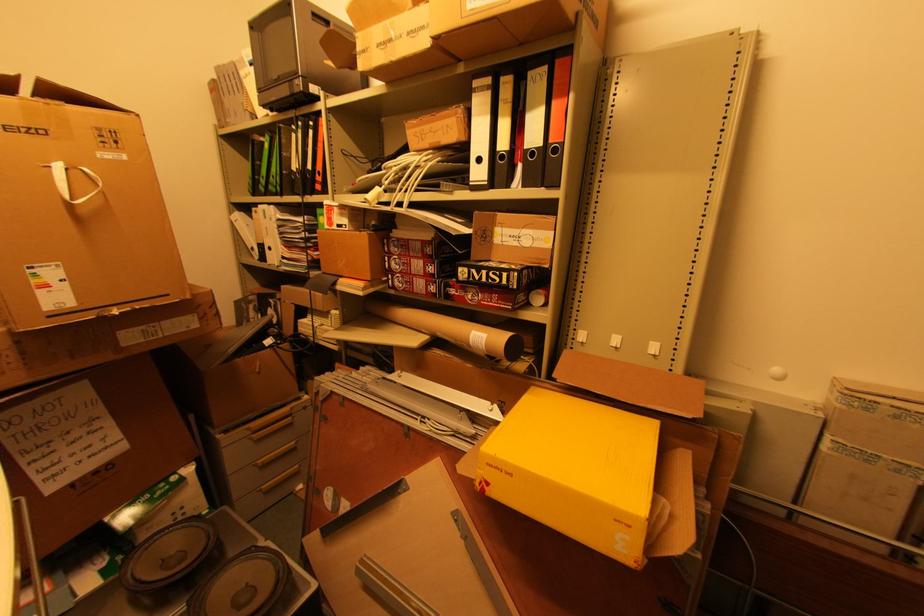
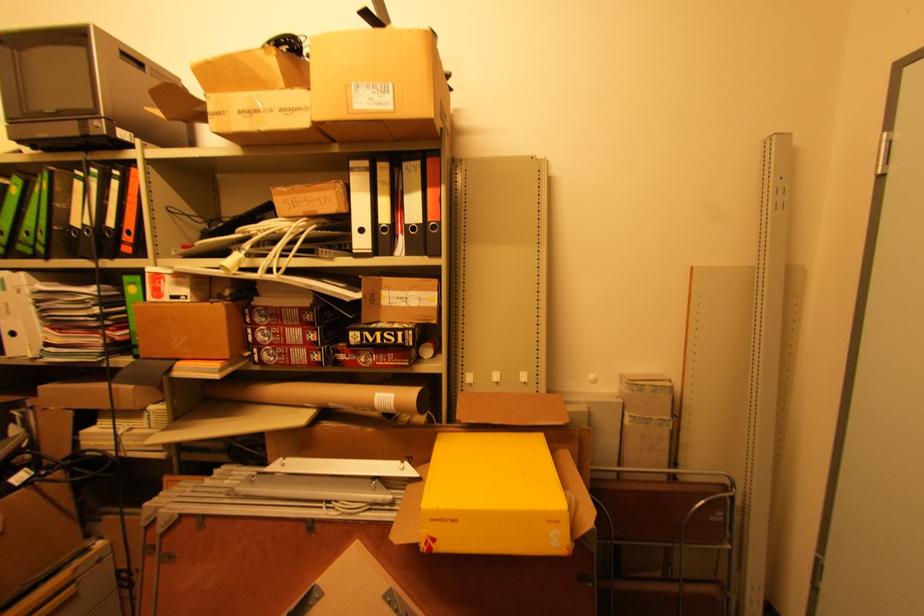
Where in the second image is the point corresponding to (388,280) from the first image?

(251, 354)